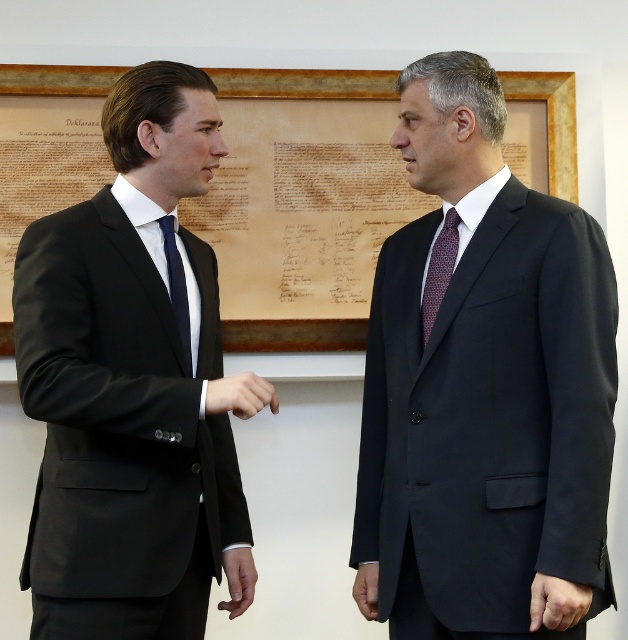
You are an interior designer planning to hang a new artwork next to the wooden framed document at center and the dark red textured tie at center. Which object should you consider in terms of width to ensure proper spacing?

The wooden framed document at center is wider than the dark red textured tie at center, so you should consider the width of the wooden framed document at center to ensure proper spacing.